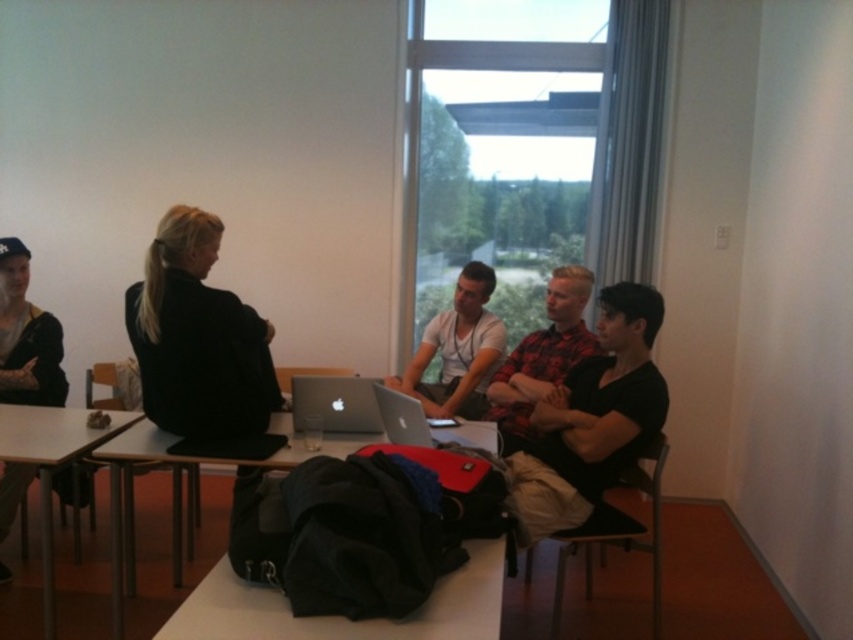
You are a photographer trying to capture a clear shot of the matte white shirt at center and the satin silver laptop at center. Since you want both subjects to be in focus, you need to know their relative positions. Which object is positioned to the right of the other?

The matte white shirt at center is to the right of the satin silver laptop at center.

You are a person sitting at the table in the classroom. You need to place a new item at the exact location of the point marked at coordinates point (x=344, y=618). What object will you be placing the new item next to?

The point (x=344, y=618) marks the location of the black fabric bag at lower center, so placing the new item there would place it next to the black fabric bag at lower center.

You are organizing a group activity and need to store the black fabric bag at lower center and the silver metallic laptop at center in a storage bin. If the bin can only hold one of them, which item should you choose based on their size?

The black fabric bag at lower center has a larger size compared to the silver metallic laptop at center, so you should choose the black fabric bag at lower center to fit in the storage bin since it requires more space.